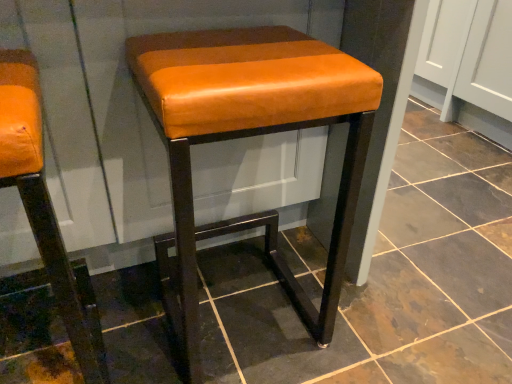
I want to click on blank space situated above matte orange leather stool at center, which appears as the 2th stool when viewed from the left (from a real-world perspective), so click(240, 49).